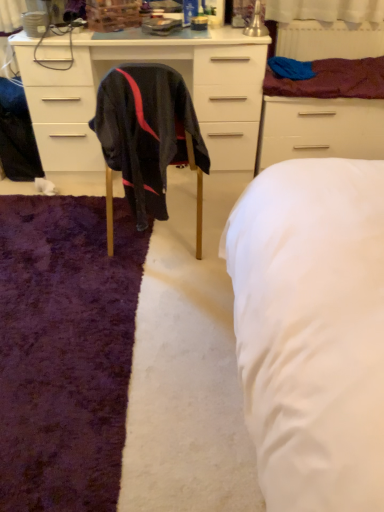
Question: From a real-world perspective, is maroon fabric at upper right positioned over white matte drawer at upper right based on gravity?

Choices:
 (A) no
 (B) yes

Answer: (B)

Question: Does maroon fabric at upper right have a larger size compared to white matte drawer at upper right?

Choices:
 (A) no
 (B) yes

Answer: (A)

Question: From the image's perspective, is maroon fabric at upper right located beneath white matte drawer at upper right?

Choices:
 (A) no
 (B) yes

Answer: (A)

Question: Considering the relative sizes of maroon fabric at upper right and white matte drawer at upper right in the image provided, is maroon fabric at upper right wider than white matte drawer at upper right?

Choices:
 (A) no
 (B) yes

Answer: (A)

Question: Does maroon fabric at upper right contain white matte drawer at upper right?

Choices:
 (A) yes
 (B) no

Answer: (B)

Question: Considering the positions of white painted radiator at upper right and black fabric chair at center in the image, is white painted radiator at upper right bigger or smaller than black fabric chair at center?

Choices:
 (A) big
 (B) small

Answer: (B)

Question: In the image, is white painted radiator at upper right positioned in front of or behind black fabric chair at center?

Choices:
 (A) front
 (B) behind

Answer: (B)

Question: Considering the relative positions of white painted radiator at upper right and black fabric chair at center in the image provided, is white painted radiator at upper right to the left or to the right of black fabric chair at center?

Choices:
 (A) right
 (B) left

Answer: (A)

Question: In terms of height, does white painted radiator at upper right look taller or shorter compared to black fabric chair at center?

Choices:
 (A) tall
 (B) short

Answer: (B)

Question: In terms of width, does matte black cabinet at center look wider or thinner when compared to maroon fabric at upper right?

Choices:
 (A) wide
 (B) thin

Answer: (A)

Question: Is point (115, 36) closer or farther from the camera than point (339, 77)?

Choices:
 (A) closer
 (B) farther

Answer: (A)

Question: Is matte black cabinet at center in front of or behind maroon fabric at upper right in the image?

Choices:
 (A) behind
 (B) front

Answer: (B)

Question: Considering the positions of matte black cabinet at center and maroon fabric at upper right in the image, is matte black cabinet at center bigger or smaller than maroon fabric at upper right?

Choices:
 (A) small
 (B) big

Answer: (B)

Question: Considering their positions, is black fabric chair at center located in front of or behind matte black cabinet at center?

Choices:
 (A) behind
 (B) front

Answer: (B)

Question: Would you say black fabric chair at center is to the left or to the right of matte black cabinet at center in the picture?

Choices:
 (A) right
 (B) left

Answer: (A)